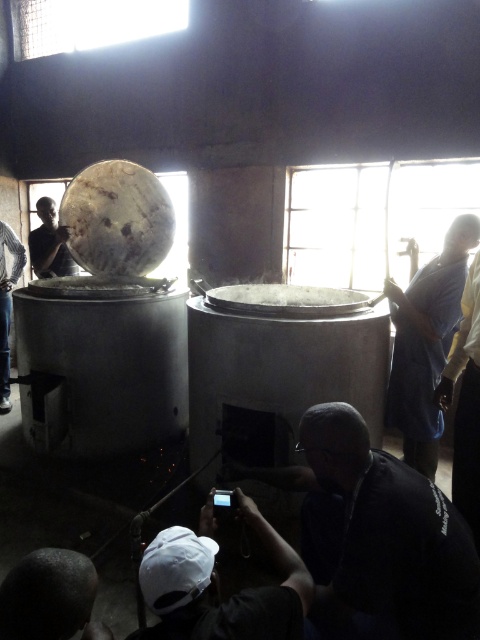
Can you confirm if matte black drum at upper left is smaller than dark blue shirt at lower left?

Actually, matte black drum at upper left might be larger than dark blue shirt at lower left.

From the picture: Who is lower down, matte black drum at upper left or dark blue shirt at lower left?

dark blue shirt at lower left is below.

Locate an element on the screen. Image resolution: width=480 pixels, height=640 pixels. matte black drum at upper left is located at coordinates (49, 243).

Which is below, dark skin head at lower left or matte black drum at upper left?

Positioned lower is dark skin head at lower left.

Can you confirm if dark skin head at lower left is positioned to the right of matte black drum at upper left?

Correct, you'll find dark skin head at lower left to the right of matte black drum at upper left.

Which is in front, point (69, 589) or point (50, 243)?

Point (69, 589) is in front.

Locate an element on the screen. The width and height of the screenshot is (480, 640). dark skin head at lower left is located at coordinates (49, 596).

Can you confirm if dark skin head at lower left is shorter than dark blue shirt at lower left?

Yes.

Does point (86, 605) come farther from viewer compared to point (24, 259)?

No.

Image resolution: width=480 pixels, height=640 pixels. I want to click on dark skin head at lower left, so click(49, 596).

Where is `dark skin head at lower left`? This screenshot has width=480, height=640. dark skin head at lower left is located at coordinates click(x=49, y=596).